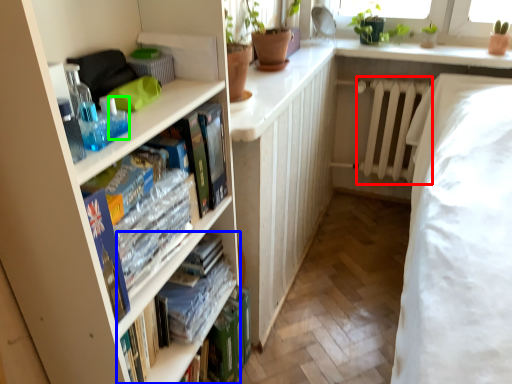
Question: Which object is positioned closest to radiator (highlighted by a red box)? Select from book (highlighted by a blue box) and toiletry (highlighted by a green box).

Choices:
 (A) book
 (B) toiletry

Answer: (A)